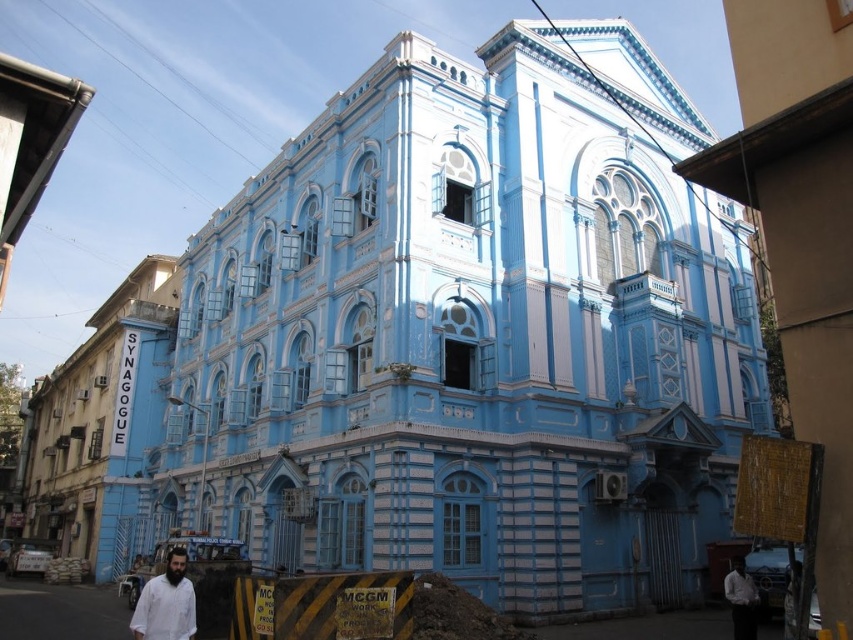
Question: Among these points, which one is farthest from the camera?

Choices:
 (A) (741, 557)
 (B) (152, 620)

Answer: (A)

Question: Does white matte shirt at lower left come behind white shirt at lower right?

Choices:
 (A) no
 (B) yes

Answer: (A)

Question: Which of the following is the closest to the observer?

Choices:
 (A) white shirt at lower right
 (B) white matte shirt at lower left

Answer: (B)

Question: Is white matte shirt at lower left below white shirt at lower right?

Choices:
 (A) no
 (B) yes

Answer: (A)

Question: Does white matte shirt at lower left come in front of white shirt at lower right?

Choices:
 (A) yes
 (B) no

Answer: (A)

Question: Which of the following is the farthest from the observer?

Choices:
 (A) (144, 605)
 (B) (744, 570)

Answer: (B)